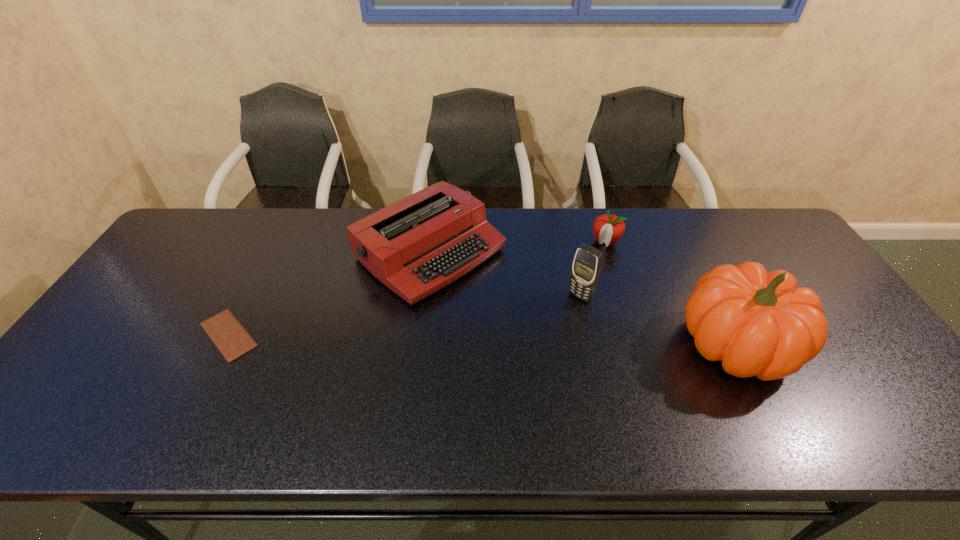
Identify the location of the shortest object. The image size is (960, 540). (229, 336).

Where is `the leftmost object`? The width and height of the screenshot is (960, 540). the leftmost object is located at coordinates (229, 336).

The image size is (960, 540). Find the location of `pumpkin`. pumpkin is located at coordinates (758, 324).

Locate an element on the screen. The height and width of the screenshot is (540, 960). the rightmost object is located at coordinates (758, 324).

The width and height of the screenshot is (960, 540). I want to click on apple, so click(x=608, y=228).

Locate an element on the screen. The height and width of the screenshot is (540, 960). typewriter is located at coordinates (416, 246).

Locate an element on the screen. the third object from right to left is located at coordinates (587, 265).

What are the coordinates of `the fourth shortest object` in the screenshot? It's located at (587, 265).

Find the location of a particular element. The height and width of the screenshot is (540, 960). vacant position located on the back of the chocolate bar is located at coordinates (280, 236).

Find the location of a particular element. This screenshot has height=540, width=960. vacant region located 0.360m on the left of the rightmost object is located at coordinates (538, 344).